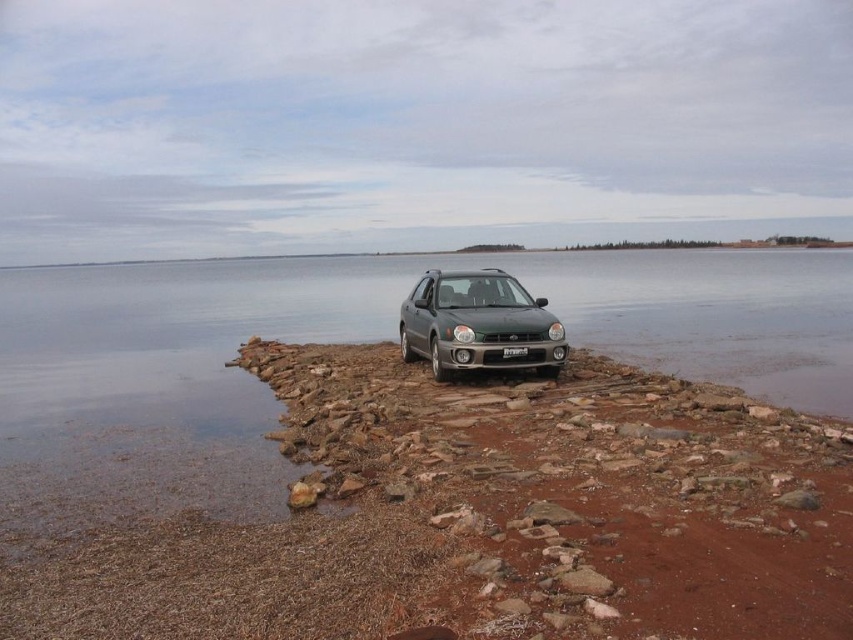
Question: Can you confirm if satin silver metallic hatchback at center is positioned above white plastic license plate at center?

Choices:
 (A) yes
 (B) no

Answer: (A)

Question: Observing the image, what is the correct spatial positioning of satin silver metallic hatchback at center in reference to white plastic license plate at center?

Choices:
 (A) right
 (B) left

Answer: (B)

Question: Does satin silver metallic hatchback at center come in front of white plastic license plate at center?

Choices:
 (A) no
 (B) yes

Answer: (B)